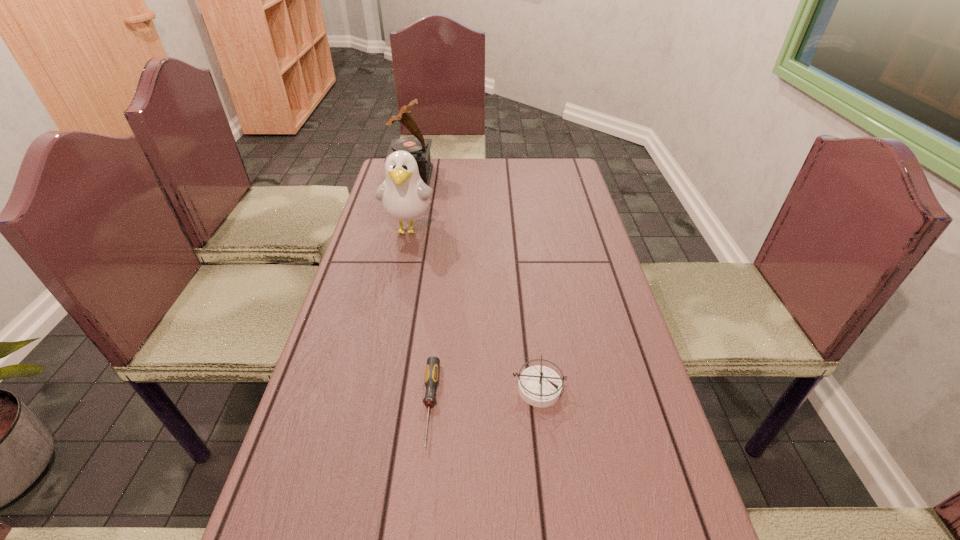
At what (x,y) coordinates should I click in order to perform the action: click on object present at the far edge. Please return your answer as a coordinate pair (x, y). This screenshot has height=540, width=960. Looking at the image, I should click on (418, 147).

At what (x,y) coordinates should I click in order to perform the action: click on phonograph_record located at the left edge. Please return your answer as a coordinate pair (x, y). Looking at the image, I should click on (418, 147).

The image size is (960, 540). What are the coordinates of `gull that is at the left edge` in the screenshot? It's located at (404, 196).

Locate an element on the screen. This screenshot has height=540, width=960. object present at the far left corner is located at coordinates (418, 147).

You are a GUI agent. You are given a task and a screenshot of the screen. Output one action in this format:
    pyautogui.click(x=<x>, y=<y>)
    Task: Click on the vacant space at the far edge of the desktop
    
    Given the screenshot: What is the action you would take?
    pyautogui.click(x=446, y=187)

Locate an element on the screen. This screenshot has width=960, height=540. vacant space at the left edge is located at coordinates (373, 245).

Locate an element on the screen. The width and height of the screenshot is (960, 540). vacant space at the right edge of the desktop is located at coordinates (626, 374).

At what (x,y) coordinates should I click in order to perform the action: click on free region at the far left corner. Please return your answer as a coordinate pair (x, y). This screenshot has width=960, height=540. Looking at the image, I should click on (382, 178).

Where is `vacant region at the far right corner of the desktop`? vacant region at the far right corner of the desktop is located at coordinates (575, 179).

Locate an element on the screen. The height and width of the screenshot is (540, 960). unoccupied position between the rightmost object and the gull is located at coordinates (473, 309).